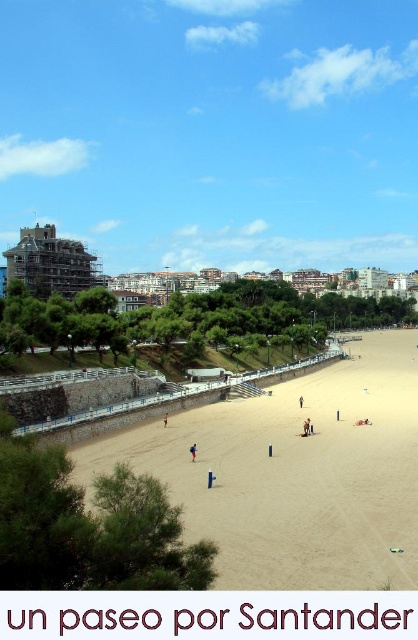
Can you confirm if bright blue fabric at center is wider than brown fabric person at center?

Indeed, bright blue fabric at center has a greater width compared to brown fabric person at center.

Does bright blue fabric at center have a smaller size compared to brown fabric person at center?

No.

Is point (193, 445) farther from camera compared to point (300, 403)?

No, (193, 445) is in front of (300, 403).

Image resolution: width=418 pixels, height=640 pixels. Identify the location of bright blue fabric at center. (193, 451).

Can you confirm if bright blue fabric at center is bigger than brown sand at center?

Yes, bright blue fabric at center is bigger than brown sand at center.

Between bright blue fabric at center and brown sand at center, which one appears on the right side from the viewer's perspective?

bright blue fabric at center is more to the right.

Identify the location of bright blue fabric at center. The width and height of the screenshot is (418, 640). (193, 451).

Describe the element at coordinates (165, 419) in the screenshot. The width and height of the screenshot is (418, 640). I see `brown sand at center` at that location.

Can you confirm if brown sand at center is taller than brown fabric person at center?

Correct, brown sand at center is much taller as brown fabric person at center.

Image resolution: width=418 pixels, height=640 pixels. What are the coordinates of `brown sand at center` in the screenshot? It's located at (165, 419).